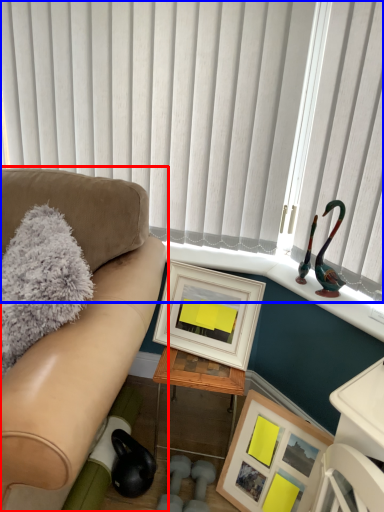
Question: Which object appears farthest to the camera in this image, studio couch (highlighted by a red box) or window blind (highlighted by a blue box)?

Choices:
 (A) studio couch
 (B) window blind

Answer: (B)